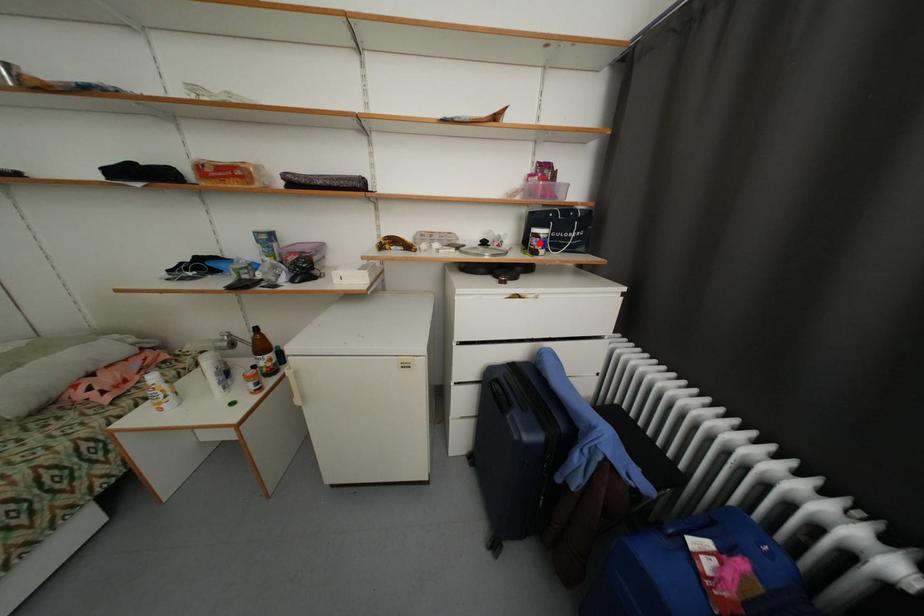
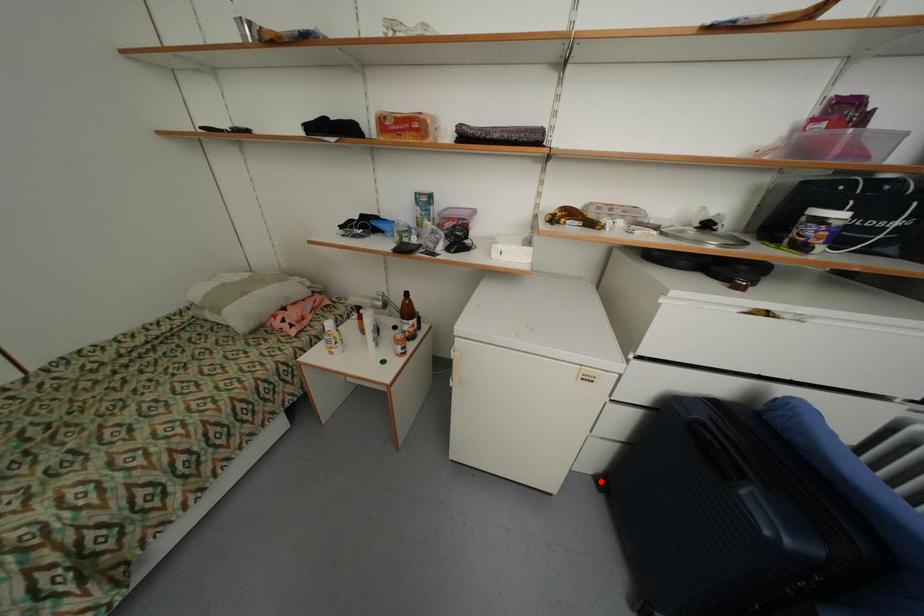
I am providing you with two images of the same scene from different viewpoints. A red point is marked on the first image and another point is marked on the second image. Do the highlighted points in image1 and image2 indicate the same real-world spot?

No